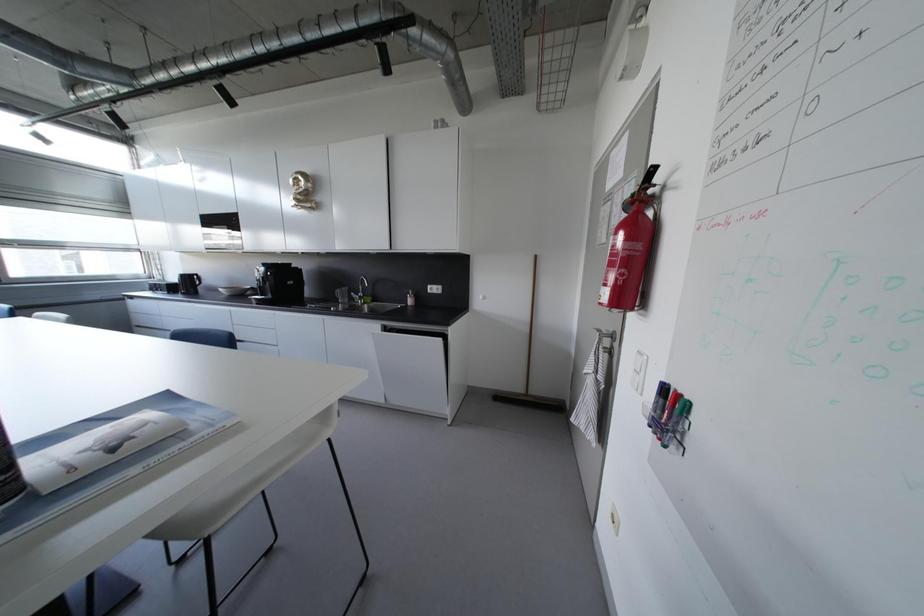
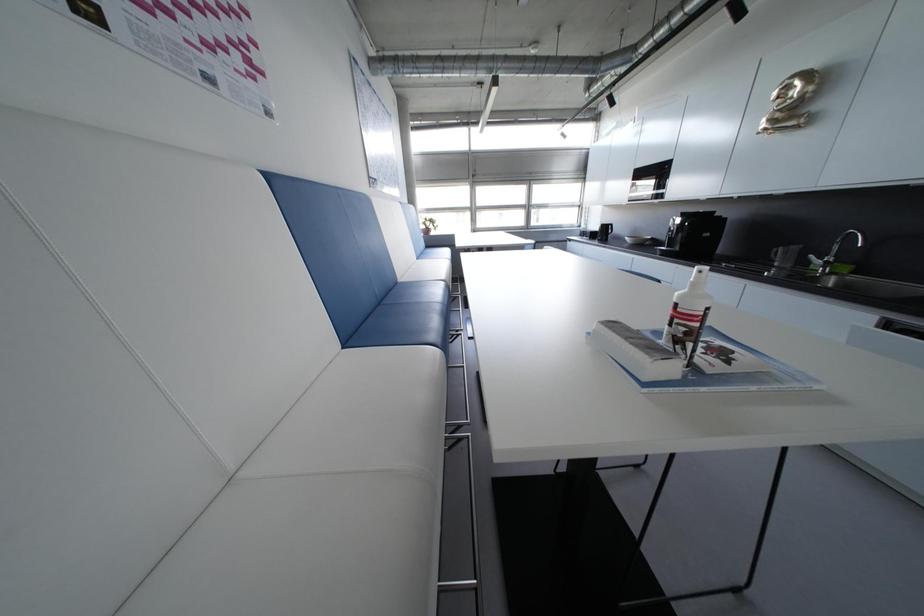
How did the camera likely rotate?

The camera's rotation is toward left-down.